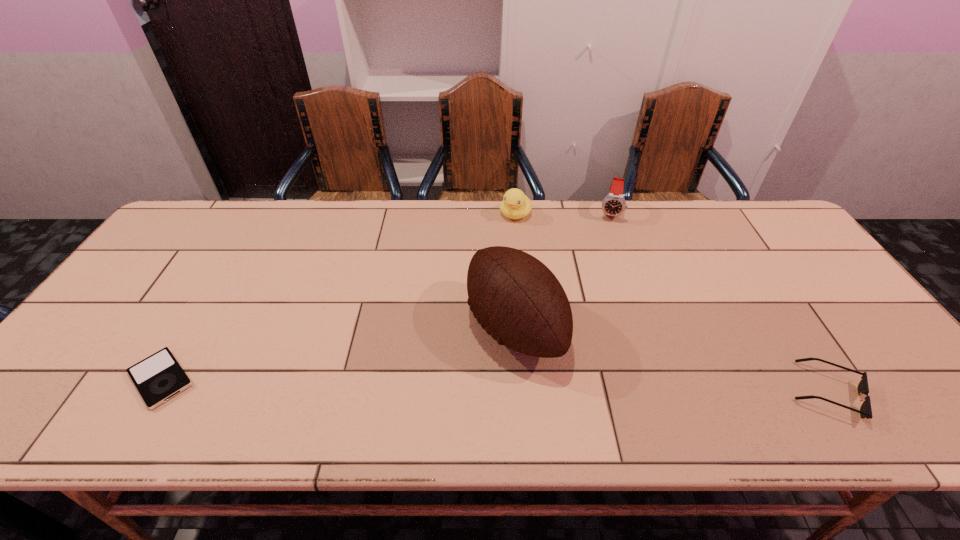
This screenshot has height=540, width=960. What are the coordinates of `the leftmost object` in the screenshot? It's located at (159, 377).

This screenshot has height=540, width=960. Identify the location of the shortest object. (159, 377).

Find the location of a particular element. The width and height of the screenshot is (960, 540). sunglasses is located at coordinates (865, 411).

Locate an element on the screen. This screenshot has height=540, width=960. the second shortest object is located at coordinates (865, 411).

This screenshot has width=960, height=540. I want to click on football, so click(x=516, y=298).

Identify the location of watch. This screenshot has width=960, height=540. (614, 204).

I want to click on duckling, so click(515, 205).

Locate an element on the screen. vacant space located on the left of the iPod is located at coordinates (64, 379).

What are the coordinates of `blank space located on the lenses of the rightmost object` in the screenshot? It's located at (892, 392).

Identify the location of free space located 0.130m on the laces of the tallest object. (424, 377).